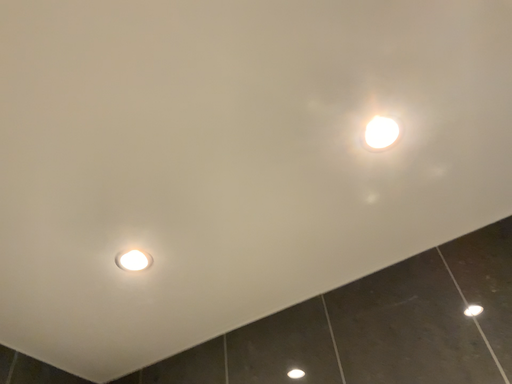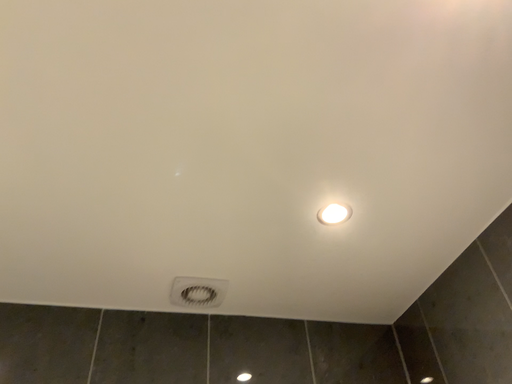
Question: How did the camera likely rotate when shooting the video?

Choices:
 (A) rotated upward
 (B) rotated downward

Answer: (B)